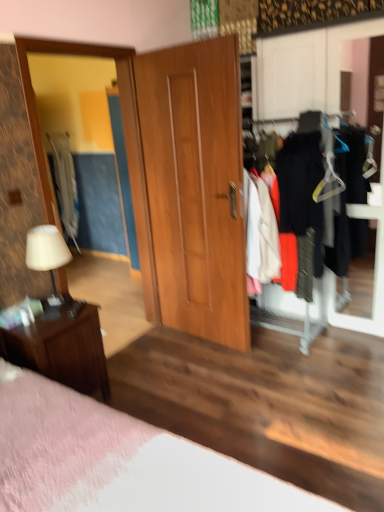
Question: From the image's perspective, is matte wooden mirror at left below light gray fabric coat at left?

Choices:
 (A) yes
 (B) no

Answer: (A)

Question: Does matte wooden mirror at left have a lesser height compared to light gray fabric coat at left?

Choices:
 (A) yes
 (B) no

Answer: (B)

Question: From a real-world perspective, is matte wooden mirror at left under light gray fabric coat at left?

Choices:
 (A) yes
 (B) no

Answer: (B)

Question: Is matte wooden mirror at left at the left side of light gray fabric coat at left?

Choices:
 (A) yes
 (B) no

Answer: (B)

Question: Is matte wooden mirror at left outside light gray fabric coat at left?

Choices:
 (A) yes
 (B) no

Answer: (A)

Question: Is matte wooden mirror at left not close to light gray fabric coat at left?

Choices:
 (A) no
 (B) yes

Answer: (B)

Question: Considering the relative positions of matte wooden mirror at left and matte black clothes at right in the image provided, is matte wooden mirror at left to the left of matte black clothes at right from the viewer's perspective?

Choices:
 (A) yes
 (B) no

Answer: (A)

Question: Is matte wooden mirror at left outside of matte black clothes at right?

Choices:
 (A) yes
 (B) no

Answer: (A)

Question: Is matte wooden mirror at left bigger than matte black clothes at right?

Choices:
 (A) no
 (B) yes

Answer: (A)

Question: Is matte wooden mirror at left aimed at matte black clothes at right?

Choices:
 (A) yes
 (B) no

Answer: (B)

Question: From a real-world perspective, does matte wooden mirror at left sit lower than matte black clothes at right?

Choices:
 (A) no
 (B) yes

Answer: (B)

Question: Considering the relative positions of matte wooden mirror at left and matte black clothes at right in the image provided, is matte wooden mirror at left to the right of matte black clothes at right from the viewer's perspective?

Choices:
 (A) yes
 (B) no

Answer: (B)

Question: Is light gray fabric coat at left bigger than matte wooden mirror at left?

Choices:
 (A) yes
 (B) no

Answer: (B)